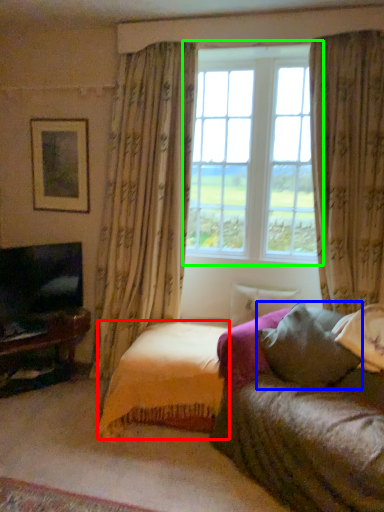
Question: Which is farther away from bedding (highlighted by a red box)? pillow (highlighted by a blue box) or window (highlighted by a green box)?

Choices:
 (A) pillow
 (B) window

Answer: (B)